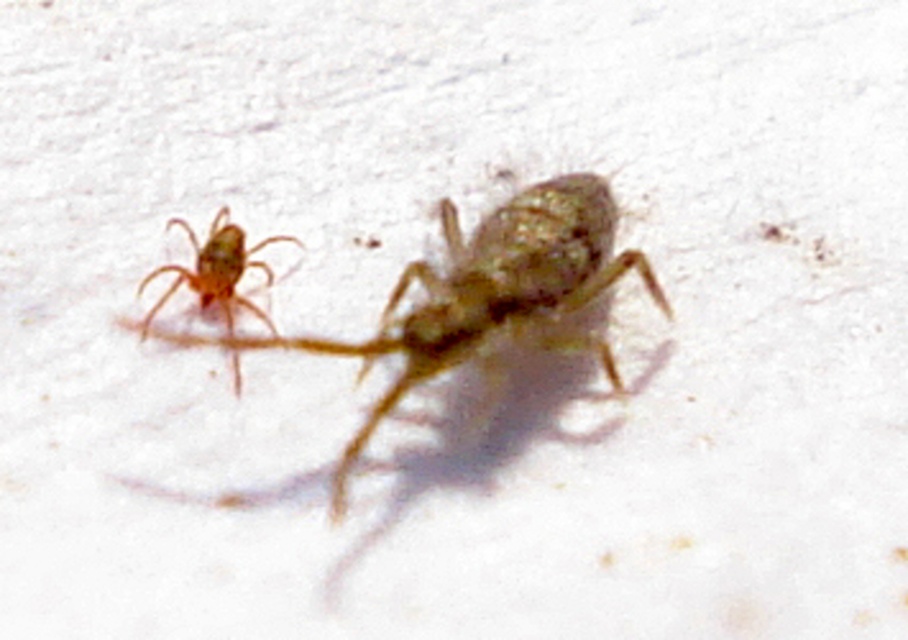
Does point (452, 273) come in front of point (242, 259)?

That is True.

Is point (476, 296) more distant than point (219, 259)?

No, it is not.

Find the location of a particular element. Image resolution: width=908 pixels, height=640 pixels. translucent brown bug at center is located at coordinates (487, 298).